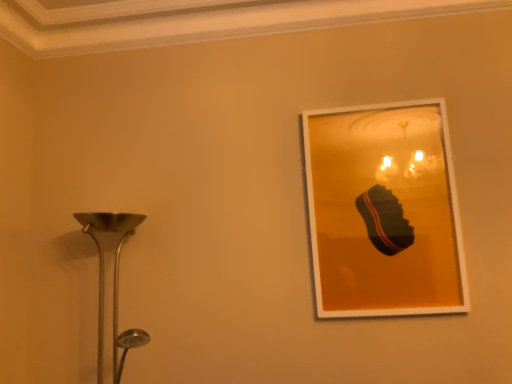
Question: Is polished silver lamp at left situated inside matte white picture frame at upper right or outside?

Choices:
 (A) inside
 (B) outside

Answer: (B)

Question: Considering the positions of polished silver lamp at left and matte white picture frame at upper right in the image, is polished silver lamp at left bigger or smaller than matte white picture frame at upper right?

Choices:
 (A) big
 (B) small

Answer: (A)

Question: In terms of width, does polished silver lamp at left look wider or thinner when compared to matte white picture frame at upper right?

Choices:
 (A) wide
 (B) thin

Answer: (A)

Question: Is matte white picture frame at upper right situated inside polished silver lamp at left or outside?

Choices:
 (A) inside
 (B) outside

Answer: (B)

Question: Is matte white picture frame at upper right to the left or to the right of polished silver lamp at left in the image?

Choices:
 (A) right
 (B) left

Answer: (A)

Question: From the image's perspective, is matte white picture frame at upper right above or below polished silver lamp at left?

Choices:
 (A) above
 (B) below

Answer: (A)

Question: In the image, is matte white picture frame at upper right positioned in front of or behind polished silver lamp at left?

Choices:
 (A) behind
 (B) front

Answer: (A)